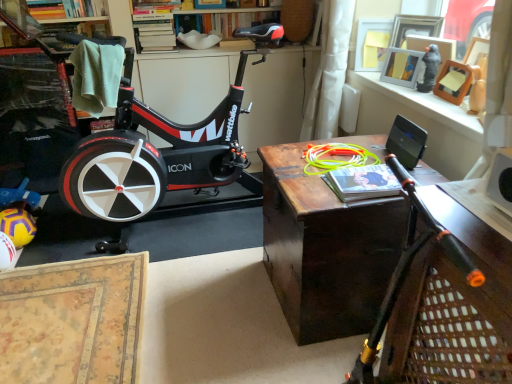
Identify the location of vacant area situated to the left side of hardcover book at center, placed as the first book when sorted from right to left. The image size is (512, 384). (305, 188).